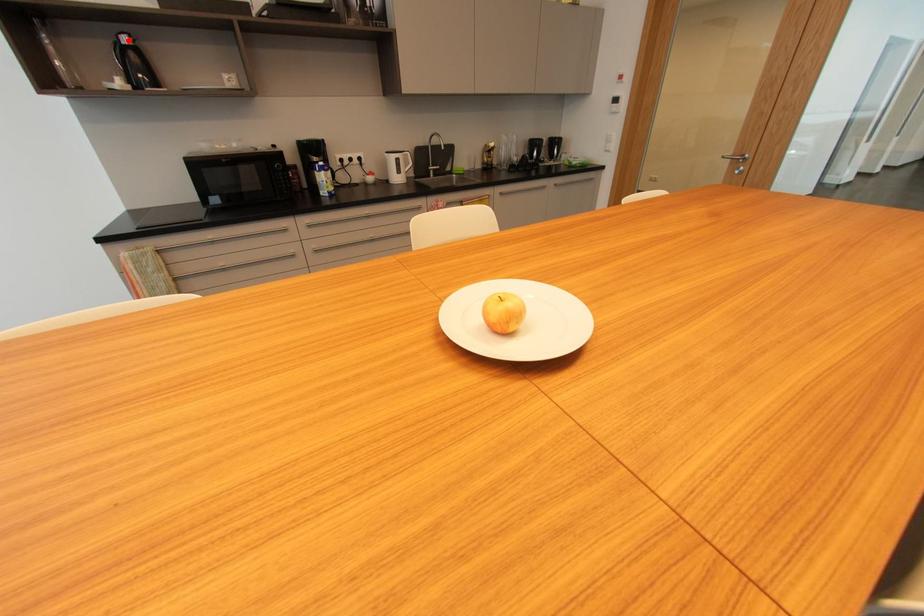
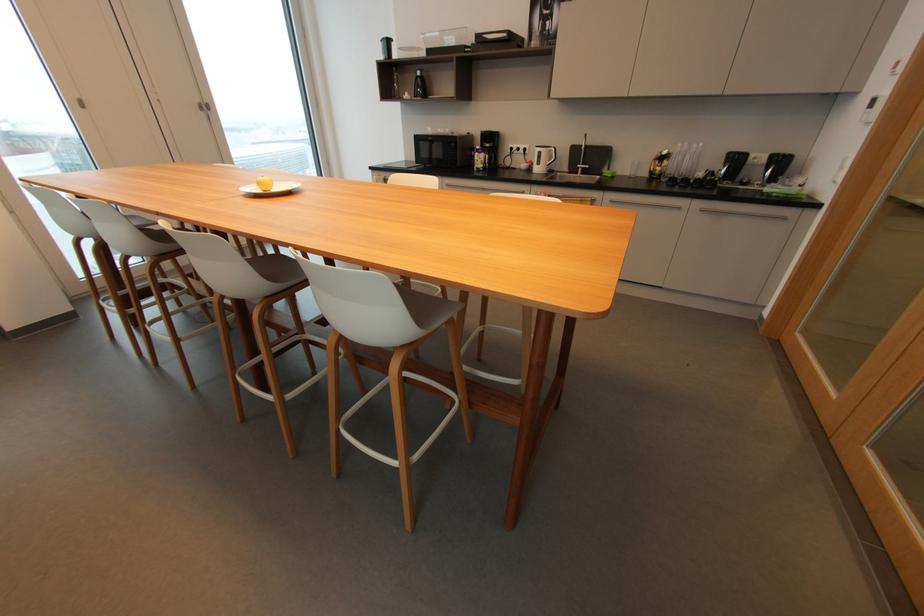
The point at the highlighted location is marked in the first image. Where is the corresponding point in the second image?

(421, 74)